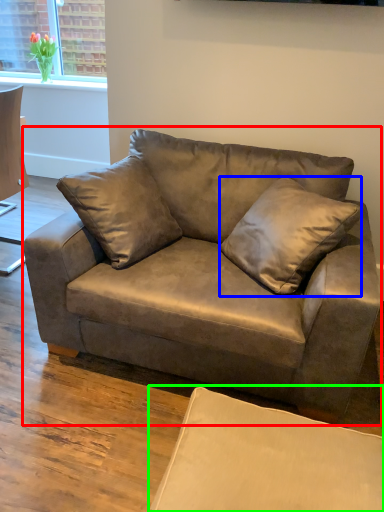
Question: Which object is the farthest from studio couch (highlighted by a red box)? Choose among these: pillow (highlighted by a blue box) or swivel chair (highlighted by a green box).

Choices:
 (A) pillow
 (B) swivel chair

Answer: (B)